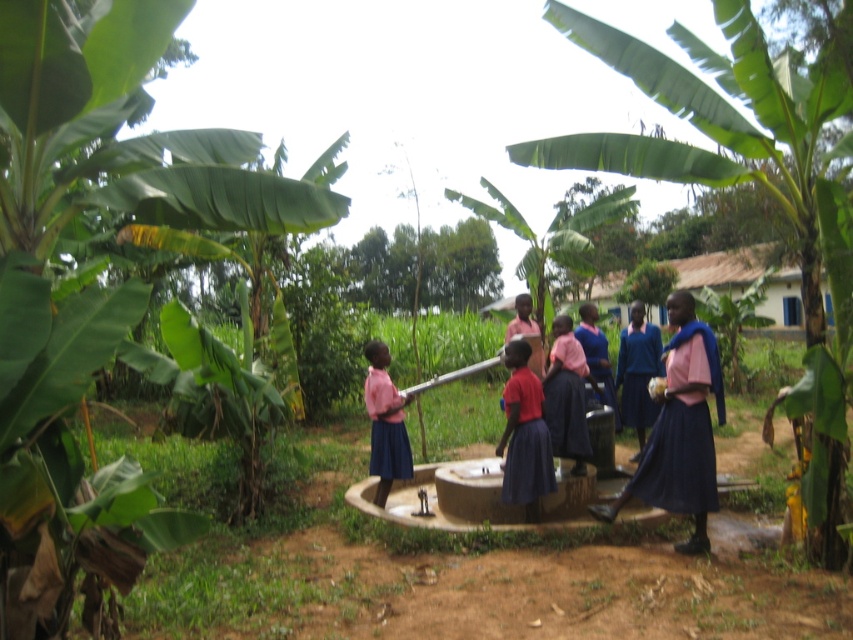
Question: Which object appears farthest from the camera in this image?

Choices:
 (A) matte pink shirt at center
 (B) matte blue skirt at center
 (C) green leafy banana tree at center

Answer: (B)

Question: Does green leafy banana tree at center appear over matte blue skirt at center?

Choices:
 (A) yes
 (B) no

Answer: (A)

Question: Which object is positioned farthest from the matte pink shirt at center?

Choices:
 (A) green leafy banana tree at left
 (B) green leafy banana tree at center

Answer: (A)

Question: Which point is farther to the camera?

Choices:
 (A) [514, 385]
 (B) [575, 154]
 (C) [6, 186]
 (D) [367, 349]

Answer: (D)

Question: From the image, what is the correct spatial relationship of matte pink shirt at center in relation to matte blue skirt at center?

Choices:
 (A) right
 (B) left

Answer: (A)

Question: Where is matte pink shirt at center located in relation to matte blue skirt at center in the image?

Choices:
 (A) below
 (B) above

Answer: (B)